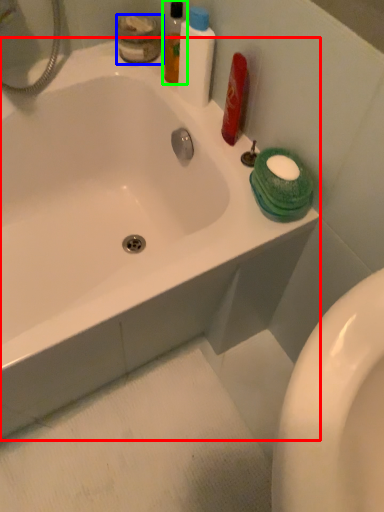
Question: Which object is positioned closest to bathtub (highlighted by a red box)? Select from toiletry (highlighted by a blue box) and mouthwash (highlighted by a green box).

Choices:
 (A) toiletry
 (B) mouthwash

Answer: (B)